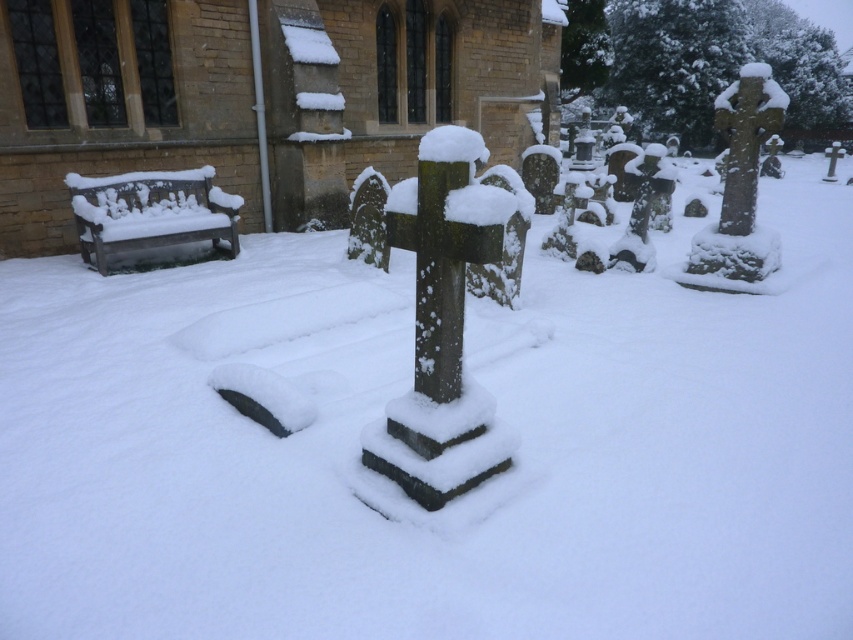
You are standing at the entrance of the churchyard and want to walk directly to the green mossy stone cross at center. Which direction should you turn to avoid the brick textured church at left?

Since the brick textured church at left is to the left of the green mossy stone cross at center, you should turn to the right to avoid the church and head towards the cross.

You are standing in the snow covered churchyard and want to walk from the brick textured church at left to the green mossy stone cross at center. Which direction should you move relative to the cross?

Since the brick textured church at left is located above the green mossy stone cross at center, you should move downward towards the cross.